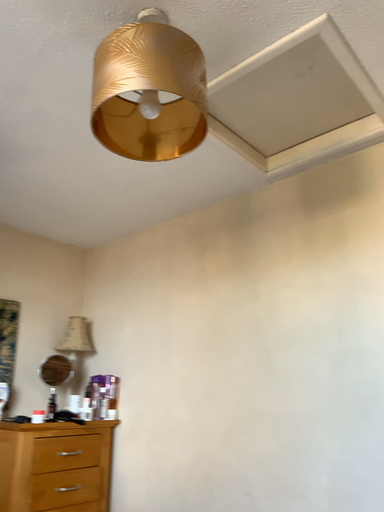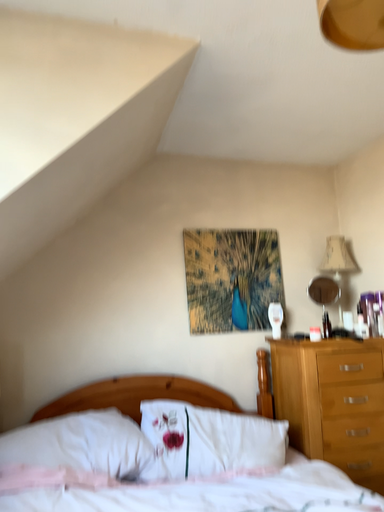
Question: How did the camera likely rotate when shooting the video?

Choices:
 (A) rotated upward
 (B) rotated downward

Answer: (B)